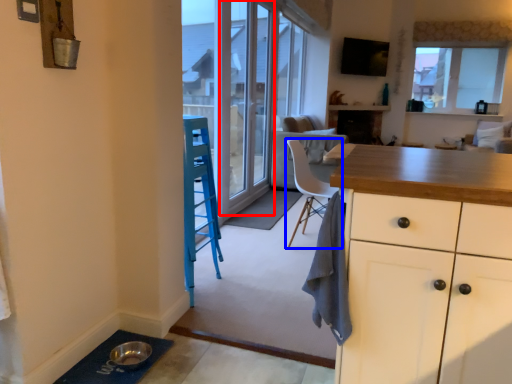
Question: Which of the following is the closest to the observer, screen door (highlighted by a red box) or chair (highlighted by a blue box)?

Choices:
 (A) screen door
 (B) chair

Answer: (B)